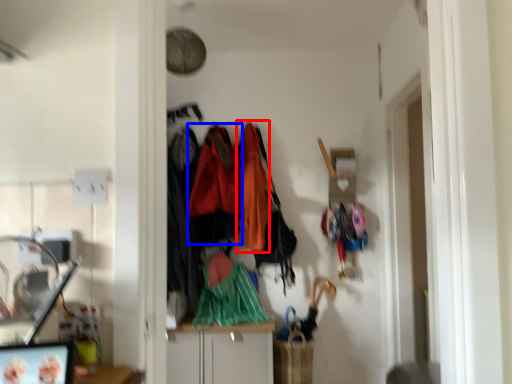
Question: Which point is closer to the camera, clothing (highlighted by a red box) or clothing (highlighted by a blue box)?

Choices:
 (A) clothing
 (B) clothing

Answer: (B)